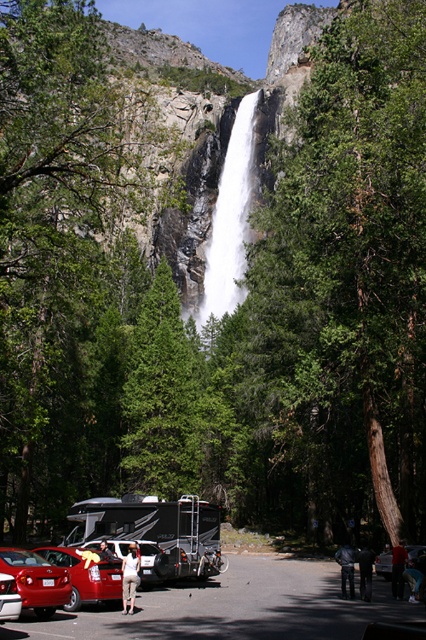
Question: Where is silver metallic rv at center located in relation to light brown leather jacket at lower center in the image?

Choices:
 (A) above
 (B) below

Answer: (A)

Question: Does jeans at center appear on the left side of light brown leather jacket at lower center?

Choices:
 (A) yes
 (B) no

Answer: (A)

Question: Among these points, which one is nearest to the camera?

Choices:
 (A) (350, 580)
 (B) (402, 596)

Answer: (A)

Question: Is metallic red sedan at lower left thinner than metallic red car at lower left?

Choices:
 (A) yes
 (B) no

Answer: (B)

Question: Considering the real-world distances, which object is farthest from the light blue jeans at center?

Choices:
 (A) green leafy tree at left
 (B) metallic red sedan at lower left
 (C) silver metallic rv at center

Answer: (A)

Question: Considering the real-world distances, which object is farthest from the green textured tree at center?

Choices:
 (A) metallic silver car at lower center
 (B) white fabric shirt at center
 (C) green leafy tree at left
 (D) metallic red sedan at lower left

Answer: (B)